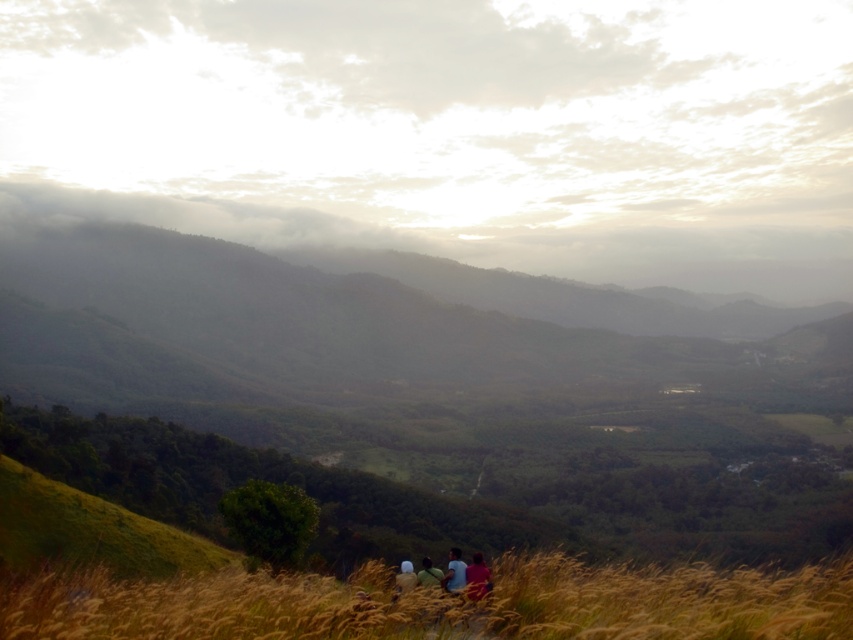
Question: Does cloudy sky at upper center come in front of blue fabric person at lower center?

Choices:
 (A) no
 (B) yes

Answer: (A)

Question: Is cloudy sky at upper center wider than blue fabric person at lower center?

Choices:
 (A) yes
 (B) no

Answer: (A)

Question: Is cloudy sky at upper center above green matte forest at center?

Choices:
 (A) yes
 (B) no

Answer: (A)

Question: Which of the following is the farthest from the observer?

Choices:
 (A) green matte forest at center
 (B) matte black shirt at lower center

Answer: (A)

Question: Which object is positioned farthest from the golden dry grass at lower center?

Choices:
 (A) blue fabric person at lower center
 (B) green matte forest at center
 (C) matte black shirt at lower center

Answer: (B)

Question: Which is farther from the blue fabric person at lower center?

Choices:
 (A) golden dry grass at lower center
 (B) green matte forest at center
 (C) matte black shirt at lower center

Answer: (B)